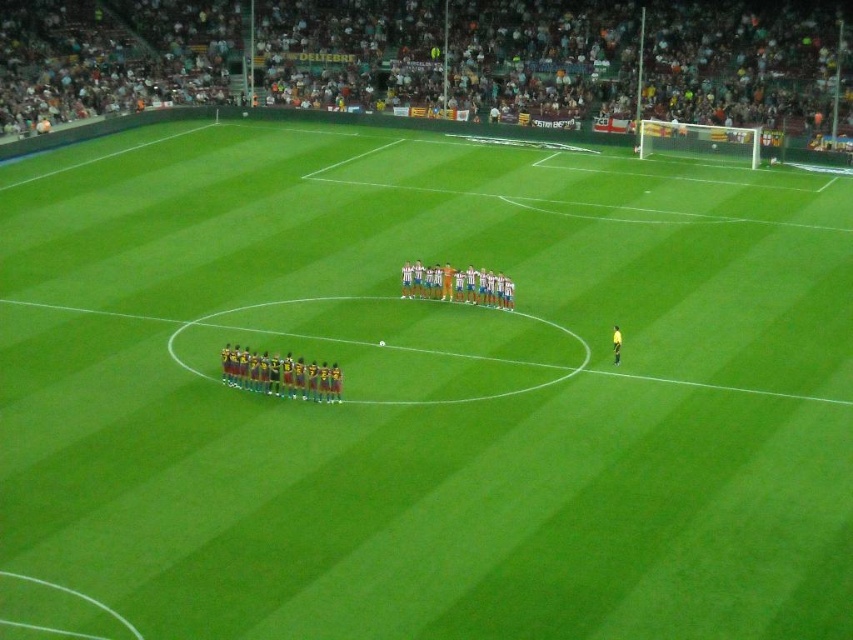
Question: Which point is farther from the camera taking this photo?

Choices:
 (A) (260, 358)
 (B) (618, 349)

Answer: (B)

Question: Which is farther from the orange jersey at center?

Choices:
 (A) yellow-green jersey at lower left
 (B) striped jersey at center

Answer: (A)

Question: Does yellow-green jersey at lower left lie behind yellow fabric referee at center?

Choices:
 (A) no
 (B) yes

Answer: (A)

Question: Which point is farther from the camera taking this photo?

Choices:
 (A) (190, 92)
 (B) (619, 333)
 (C) (427, 284)

Answer: (A)

Question: Does yellow-green jersey at lower left have a smaller size compared to striped jersey at center?

Choices:
 (A) no
 (B) yes

Answer: (B)

Question: Can you confirm if orange jersey at center is positioned below striped jersey at center?

Choices:
 (A) no
 (B) yes

Answer: (A)